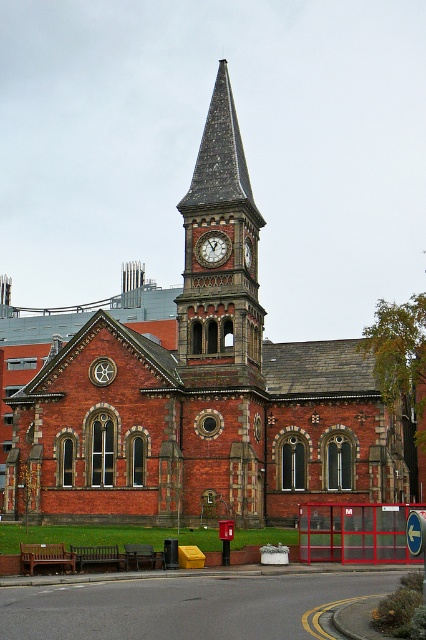
Which of these two, red brick church at center or matte brown clock at center, stands taller?

red brick church at center is taller.

Does red brick church at center appear over matte brown clock at center?

Yes, red brick church at center is above matte brown clock at center.

The image size is (426, 640). I want to click on red brick church at center, so click(x=196, y=390).

Is dark brown stone clock tower at center behind matte brown clock at center?

No.

Is point (209, 122) positioned behind point (250, 266)?

Yes, it is.

You are a GUI agent. You are given a task and a screenshot of the screen. Output one action in this format:
    pyautogui.click(x=<x>, y=<y>)
    Task: Click on the dark brown stone clock tower at center
    The height and width of the screenshot is (640, 426).
    Given the screenshot: What is the action you would take?
    (224, 262)

Can you confirm if matte red clock at center is wider than matte brown clock at center?

Correct, the width of matte red clock at center exceeds that of matte brown clock at center.

Is matte red clock at center closer to camera compared to matte brown clock at center?

No, matte red clock at center is behind matte brown clock at center.

Does point (210, 230) lie behind point (245, 248)?

No, (210, 230) is closer to viewer.

This screenshot has height=640, width=426. In order to click on matte red clock at center in this screenshot , I will do `click(213, 248)`.